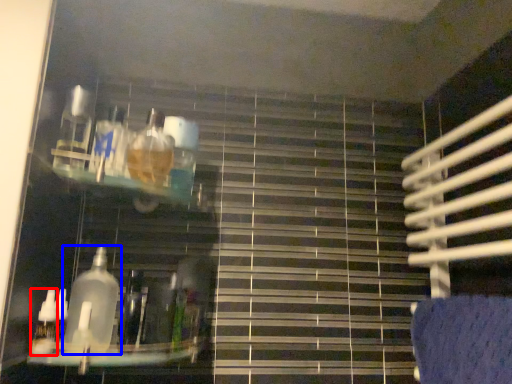
Question: Which of the following is the closest to the observer, bottle (highlighted by a red box) or bottle (highlighted by a blue box)?

Choices:
 (A) bottle
 (B) bottle

Answer: (B)